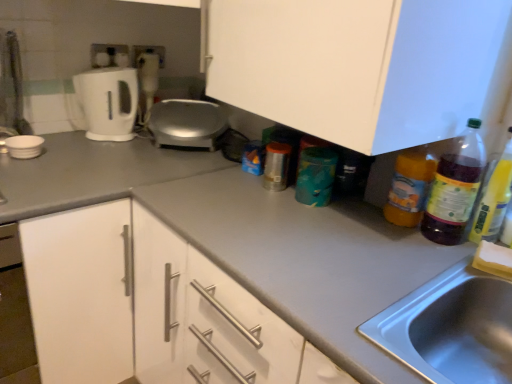
Question: From the image's perspective, is translucent plastic bottle at right, placed as the first bottle when sorted from left to right, positioned above or below white matte bowl at left, the first appliance in the left-to-right sequence?

Choices:
 (A) above
 (B) below

Answer: (B)

Question: Considering the positions of translucent plastic bottle at right, placed as the first bottle when sorted from left to right, and white matte bowl at left, the second appliance in the back-to-front sequence, in the image, is translucent plastic bottle at right, placed as the first bottle when sorted from left to right, wider or thinner than white matte bowl at left, the second appliance in the back-to-front sequence,?

Choices:
 (A) thin
 (B) wide

Answer: (A)

Question: Estimate the real-world distances between objects in this image. Which object is farther from the white matte cabinet at center?

Choices:
 (A) translucent plastic bottle at right, the 1th bottle viewed from the right
 (B) translucent plastic bottle at right
 (C) white plastic blender at upper left
 (D) white glossy electric kettle at upper left
 (E) white matte bowl at left, which is the second appliance from right to left

Answer: (E)

Question: Estimate the real-world distances between objects in this image. Which object is closer to the translucent plastic bottle at right?

Choices:
 (A) white plastic blender at upper left
 (B) white matte bowl at left, the 1th appliance in the front-to-back sequence
 (C) white matte cabinet at center
 (D) translucent plastic bottle at right, placed as the first bottle when sorted from left to right
 (E) satin silver appliance at center, placed as the second appliance when sorted from left to right

Answer: (D)